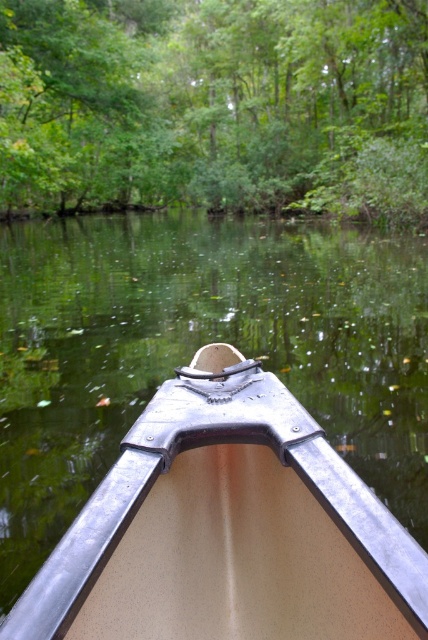
Question: Is green leafy tree at upper center wider than metallic tan boat at center?

Choices:
 (A) yes
 (B) no

Answer: (A)

Question: Does green leafy tree at upper center appear on the right side of metallic tan boat at center?

Choices:
 (A) no
 (B) yes

Answer: (A)

Question: Which object appears closest to the camera in this image?

Choices:
 (A) metallic tan boat at center
 (B) green leafy tree at upper center

Answer: (A)

Question: Which object is closer to the camera taking this photo?

Choices:
 (A) metallic tan boat at center
 (B) green leafy tree at upper center

Answer: (A)

Question: Does green leafy tree at upper center come behind metallic tan boat at center?

Choices:
 (A) no
 (B) yes

Answer: (B)